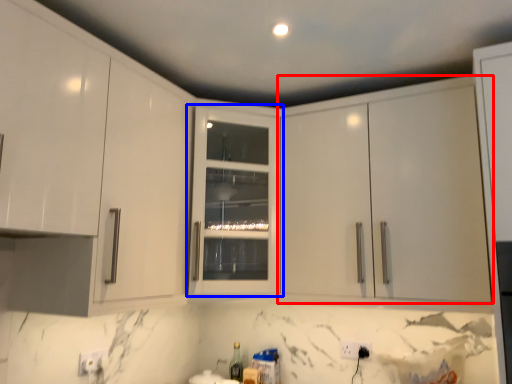
Question: Which object appears closest to the camera in this image, cabinetry (highlighted by a red box) or cabinetry (highlighted by a blue box)?

Choices:
 (A) cabinetry
 (B) cabinetry

Answer: (A)